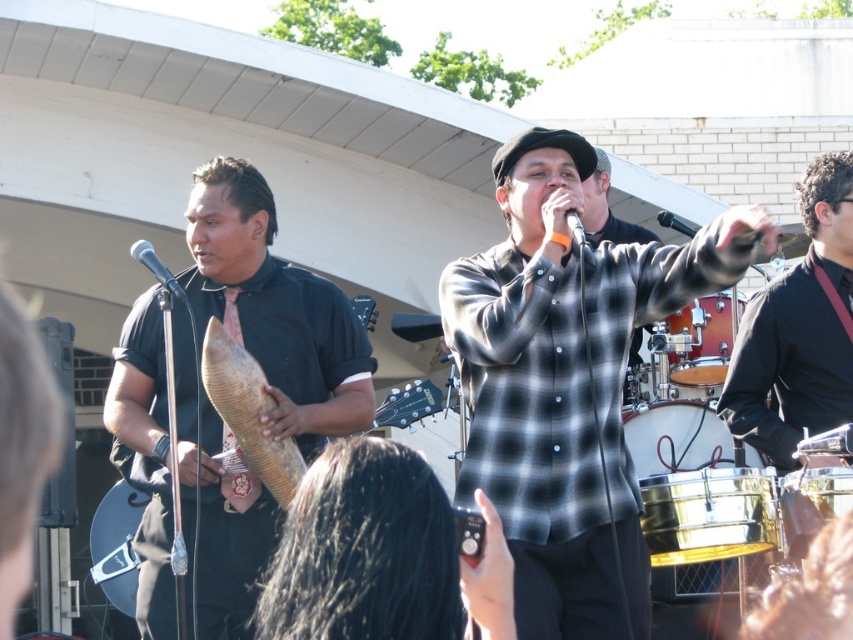
You are a photographer trying to capture the singer in the center. The black checkered shirt at center and the metallic silver microphone at center are both in your frame. Which object should you focus on if you want to ensure the larger object is sharp?

The black checkered shirt at center is larger in size than the metallic silver microphone at center, so you should focus on the black checkered shirt at center to ensure the larger object is sharp.